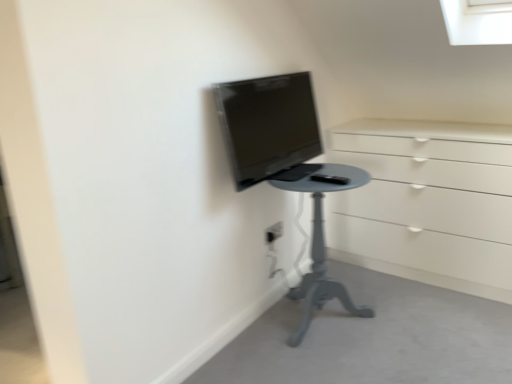
Question: Considering the relative sizes of matte black monitor at center and white plastic electric outlet at center in the image provided, is matte black monitor at center wider than white plastic electric outlet at center?

Choices:
 (A) no
 (B) yes

Answer: (B)

Question: Is white plastic electric outlet at center completely or partially inside matte black monitor at center?

Choices:
 (A) yes
 (B) no

Answer: (B)

Question: Can you confirm if matte black monitor at center is shorter than white plastic electric outlet at center?

Choices:
 (A) yes
 (B) no

Answer: (B)

Question: Is matte black monitor at center closer to camera compared to white plastic electric outlet at center?

Choices:
 (A) yes
 (B) no

Answer: (A)

Question: Can you confirm if matte black monitor at center is smaller than white plastic electric outlet at center?

Choices:
 (A) no
 (B) yes

Answer: (A)

Question: Is matte black monitor at center to the left of white plastic electric outlet at center from the viewer's perspective?

Choices:
 (A) yes
 (B) no

Answer: (B)

Question: Is smooth gray table at lower center at the back of matte black monitor at center?

Choices:
 (A) no
 (B) yes

Answer: (A)

Question: Does matte black monitor at center turn towards smooth gray table at lower center?

Choices:
 (A) yes
 (B) no

Answer: (B)

Question: Does matte black monitor at center appear on the right side of smooth gray table at lower center?

Choices:
 (A) yes
 (B) no

Answer: (B)

Question: From the image's perspective, is matte black monitor at center above smooth gray table at lower center?

Choices:
 (A) no
 (B) yes

Answer: (B)

Question: From a real-world perspective, is matte black monitor at center on top of smooth gray table at lower center?

Choices:
 (A) yes
 (B) no

Answer: (A)

Question: Can you confirm if matte black monitor at center is taller than smooth gray table at lower center?

Choices:
 (A) no
 (B) yes

Answer: (B)

Question: Is matte gray table at center beside smooth gray table at lower center?

Choices:
 (A) no
 (B) yes

Answer: (A)